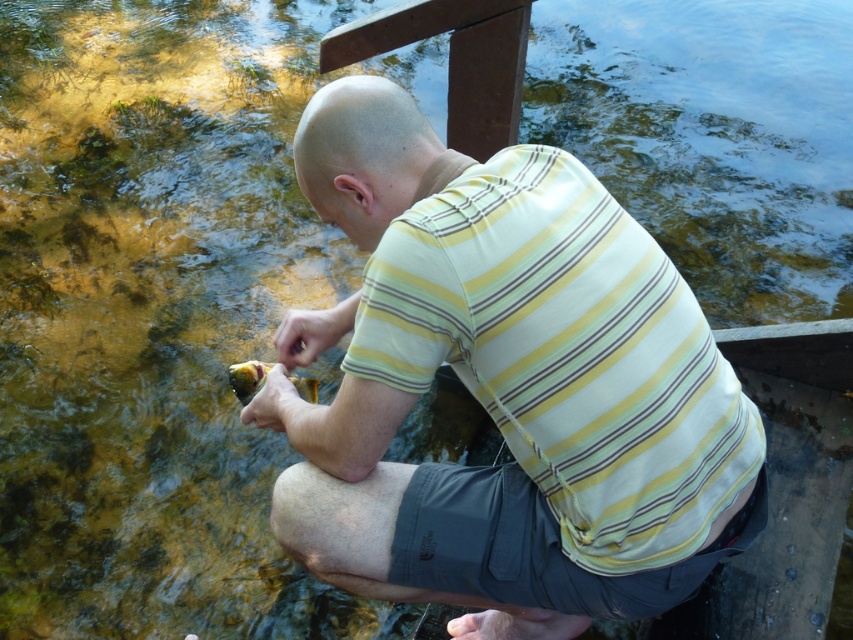
Is yellow striped shirt at center taller than shiny yellow fish at lower left?

Yes.

Which of these two, yellow striped shirt at center or shiny yellow fish at lower left, stands taller?

With more height is yellow striped shirt at center.

Locate an element on the screen. Image resolution: width=853 pixels, height=640 pixels. yellow striped shirt at center is located at coordinates (500, 384).

Where is `yellow striped shirt at center`? The image size is (853, 640). yellow striped shirt at center is located at coordinates (500, 384).